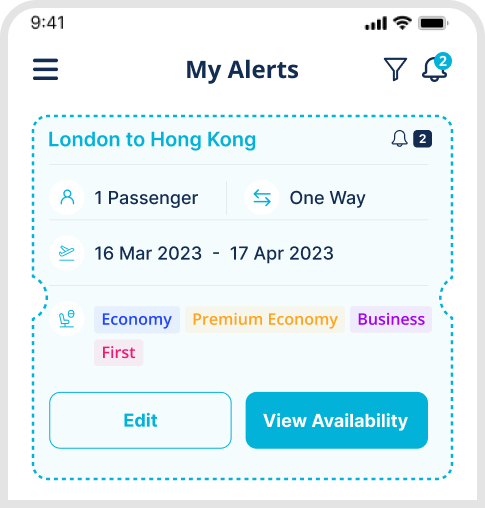
Find the location of a particular element. seat icon is located at coordinates (62, 319).